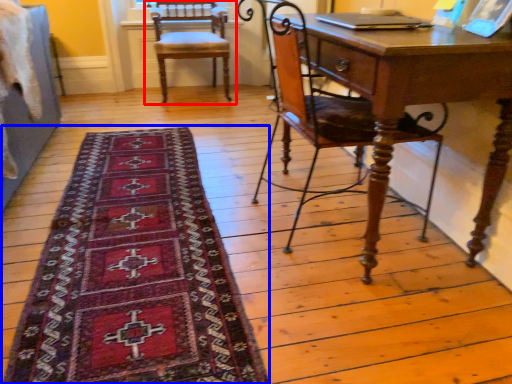
Question: Which of the following is the closest to the observer, chair (highlighted by a red box) or mat (highlighted by a blue box)?

Choices:
 (A) chair
 (B) mat

Answer: (B)